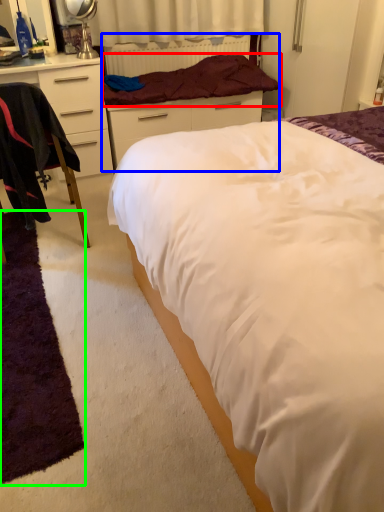
Question: Based on their relative distances, which object is nearer to blanket (highlighted by a red box)? Choose from bed frame (highlighted by a blue box) and mat (highlighted by a green box).

Choices:
 (A) bed frame
 (B) mat

Answer: (A)